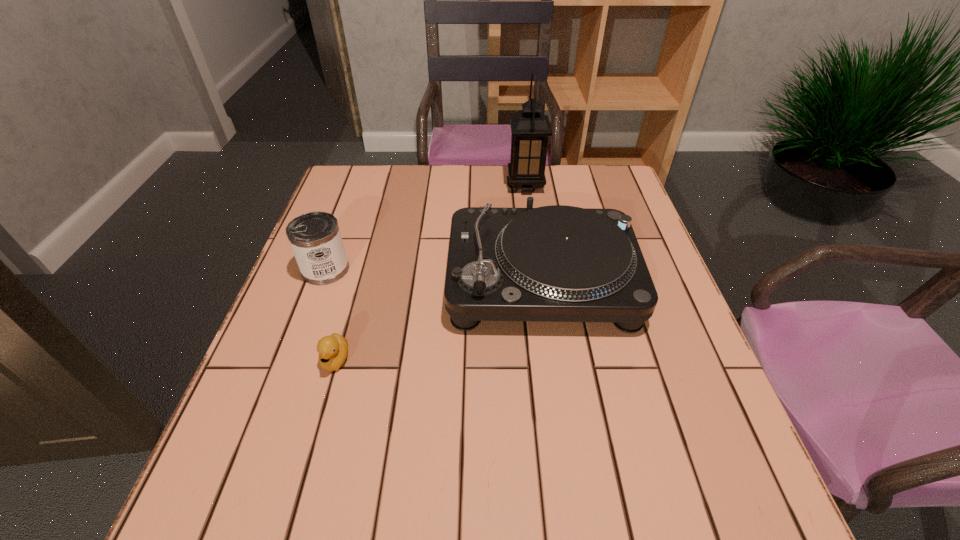
Locate an element on the screen. vacant space that's between the second object from left to right and the can is located at coordinates (330, 314).

I want to click on empty space between the leftmost object and the second object from left to right, so click(x=330, y=314).

The width and height of the screenshot is (960, 540). Find the location of `free space that is in between the second object from left to right and the record player`. free space that is in between the second object from left to right and the record player is located at coordinates (439, 320).

Locate an element on the screen. Image resolution: width=960 pixels, height=540 pixels. free spot between the nearest object and the leftmost object is located at coordinates [330, 314].

The height and width of the screenshot is (540, 960). Identify the location of free area in between the tallest object and the third object from right to left. (431, 273).

Identify the location of vacant region between the record player and the leftmost object. This screenshot has height=540, width=960. (434, 275).

Identify the location of vacant space that is in between the can and the farthest object. The image size is (960, 540). (425, 227).

Locate an element on the screen. This screenshot has height=540, width=960. vacant area between the leftmost object and the record player is located at coordinates (434, 275).

Find the location of a particular element. vacant area that lies between the nearest object and the can is located at coordinates (330, 314).

Locate an element on the screen. object that stands as the second closest to the nearest object is located at coordinates (557, 263).